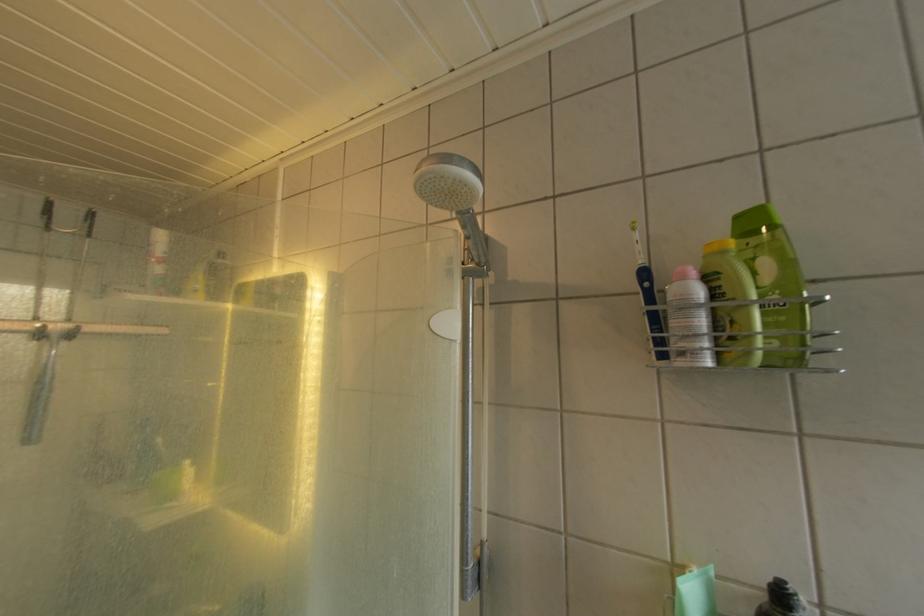
Locate an element on the screen. The image size is (924, 616). silver shower head is located at coordinates (454, 196).